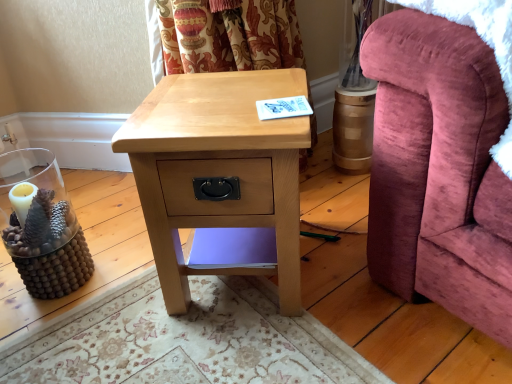
Question: From the image's perspective, is natural wood nightstand at center over velvet pink armchair at right?

Choices:
 (A) yes
 (B) no

Answer: (B)

Question: Does natural wood nightstand at center have a greater height compared to velvet pink armchair at right?

Choices:
 (A) no
 (B) yes

Answer: (B)

Question: Can you confirm if natural wood nightstand at center is smaller than velvet pink armchair at right?

Choices:
 (A) no
 (B) yes

Answer: (B)

Question: Is natural wood nightstand at center positioned with its back to velvet pink armchair at right?

Choices:
 (A) yes
 (B) no

Answer: (B)

Question: Is natural wood nightstand at center positioned in front of velvet pink armchair at right?

Choices:
 (A) no
 (B) yes

Answer: (A)

Question: Can you confirm if natural wood nightstand at center is wider than velvet pink armchair at right?

Choices:
 (A) yes
 (B) no

Answer: (B)

Question: Does velvet pink armchair at right have a greater height compared to natural wood nightstand at center?

Choices:
 (A) yes
 (B) no

Answer: (B)

Question: Is velvet pink armchair at right shorter than natural wood nightstand at center?

Choices:
 (A) yes
 (B) no

Answer: (A)

Question: Is the position of velvet pink armchair at right more distant than that of natural wood nightstand at center?

Choices:
 (A) yes
 (B) no

Answer: (B)

Question: From the image's perspective, is velvet pink armchair at right below natural wood nightstand at center?

Choices:
 (A) no
 (B) yes

Answer: (A)

Question: Is velvet pink armchair at right far away from natural wood nightstand at center?

Choices:
 (A) yes
 (B) no

Answer: (B)

Question: Is velvet pink armchair at right facing towards natural wood nightstand at center?

Choices:
 (A) yes
 (B) no

Answer: (B)

Question: In terms of height, does natural wood nightstand at center look taller or shorter compared to velvet pink armchair at right?

Choices:
 (A) short
 (B) tall

Answer: (B)